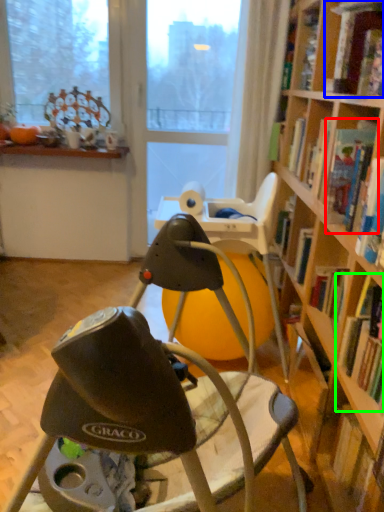
Question: Which object is the closest to the book (highlighted by a red box)? Choose among these: book (highlighted by a blue box) or book (highlighted by a green box).

Choices:
 (A) book
 (B) book

Answer: (A)